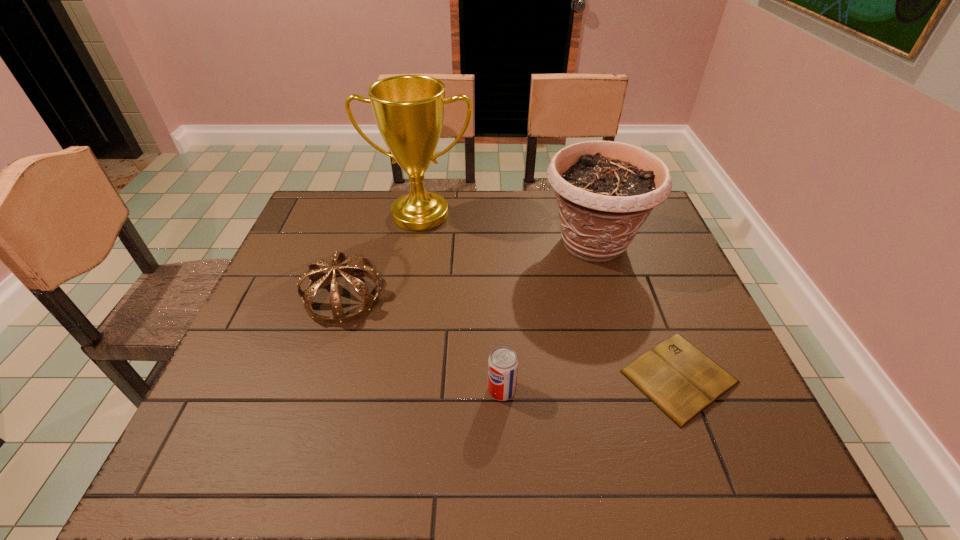
This screenshot has width=960, height=540. In order to click on award in this screenshot , I will do `click(409, 109)`.

Where is `the fourth shortest object`? the fourth shortest object is located at coordinates (605, 190).

Find the location of a particular element. This screenshot has width=960, height=540. the third tallest object is located at coordinates (317, 277).

Where is `the fourth tallest object`? The height and width of the screenshot is (540, 960). the fourth tallest object is located at coordinates (503, 362).

Locate an element on the screen. The width and height of the screenshot is (960, 540). the third object from right to left is located at coordinates (503, 362).

Image resolution: width=960 pixels, height=540 pixels. Identify the location of the shortest object. (682, 381).

At what (x,y) coordinates should I click in order to perform the action: click on vacant region located by the handles of the tallest object. Please return your answer as a coordinate pair (x, y). Looking at the image, I should click on 415,247.

Identify the location of free space located 0.080m on the left of the second tallest object. (513, 244).

This screenshot has width=960, height=540. What are the coordinates of `vacant space located 0.080m on the left of the tiara` in the screenshot? It's located at click(273, 298).

This screenshot has width=960, height=540. Identify the location of free spot located 0.140m on the back of the second shortest object. (499, 329).